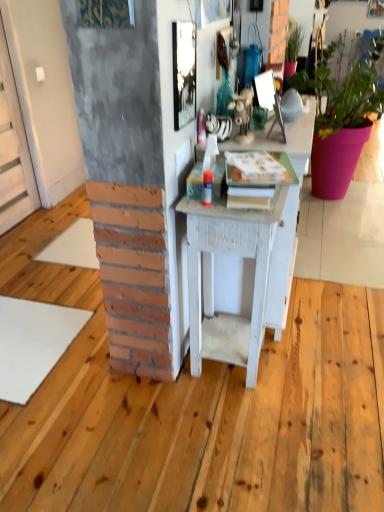
Question: In terms of height, does matte pink pot at right, positioned as the 2th houseplant in left-to-right order, look taller or shorter compared to green matte plant at upper right, the 2th houseplant positioned from the right?

Choices:
 (A) tall
 (B) short

Answer: (A)

Question: From a real-world perspective, is matte pink pot at right, placed as the first houseplant when sorted from right to left, positioned above or below green matte plant at upper right, which appears as the 1th houseplant when viewed from the left?

Choices:
 (A) below
 (B) above

Answer: (A)

Question: Which object is the closest to the matte pink pot at right, positioned as the 2th houseplant in left-to-right order?

Choices:
 (A) white painted wood desk at center
 (B) metallic reflective mirror at upper center, marked as the second picture frame in a front-to-back arrangement
 (C) green matte plant at upper right, which appears as the 1th houseplant when viewed from the left
 (D) metallic textured picture frame at upper center, the 2th picture frame positioned from the right

Answer: (C)

Question: Which of these objects is positioned closest to the matte pink pot at right, positioned as the 2th houseplant in left-to-right order?

Choices:
 (A) white painted wood desk at center
 (B) green matte plant at upper right, which appears as the 1th houseplant when viewed from the left
 (C) metallic textured picture frame at upper center, which is counted as the 2th picture frame, starting from the back
 (D) metallic reflective mirror at upper center, which is the 2th picture frame in left-to-right order

Answer: (B)